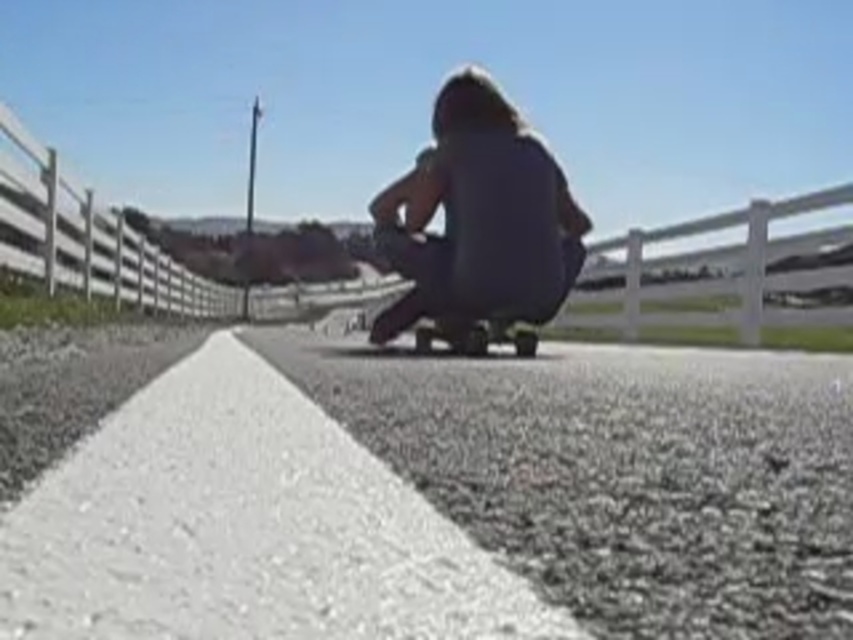
You are standing at the origin point of the coordinate system in this image. You want to walk towards the white wooden fence at center. In which direction should you head?

Since the white wooden fence at center is located at coordinate point (90, 241), you should head towards the direction of positive x and negative y axes to reach it.

You are standing at the center of the paved road and want to pick up the matte gray hoodie at center. In which direction should you move to reach it?

The matte gray hoodie at center is located at point coordinates 0.342 on the x axis and 0.563 on the y axis. Since you are at the center of the road, you need to move slightly to the left and forward to reach it.

You are a photographer standing at the camera position. You want to capture a closeup shot of the matte gray hoodie at center. What is the coordinate where you should focus your camera?

The matte gray hoodie at center is located at coordinate point [479,218]. Therefore, you should focus your camera at point [479,218] to capture the closeup shot.